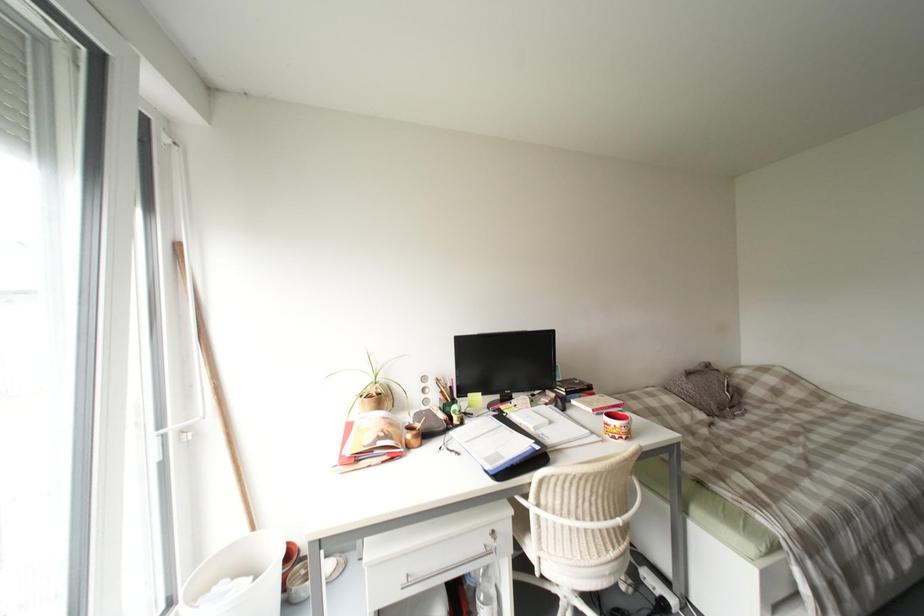
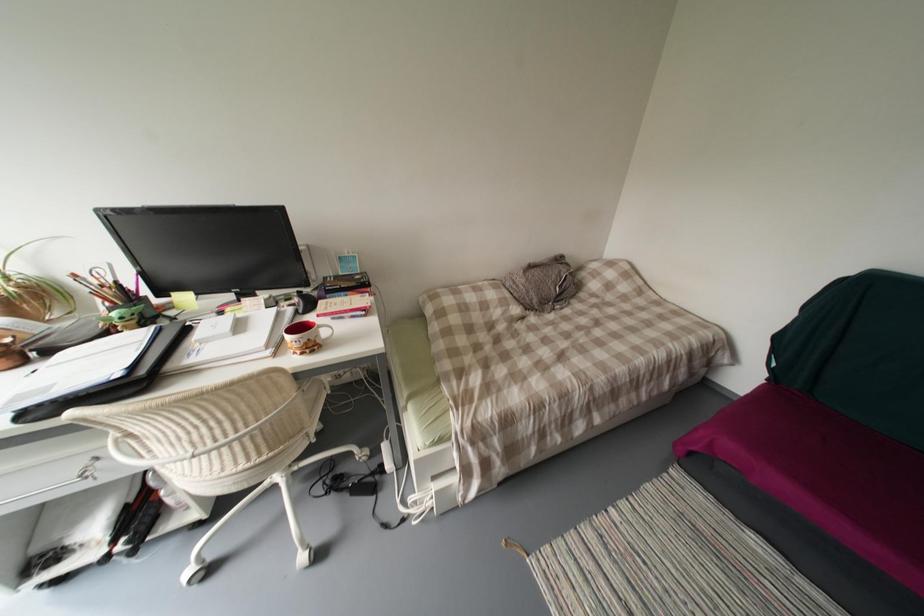
Question: The images are taken continuously from a first-person perspective. In which direction are you moving?

Choices:
 (A) Left
 (B) Right
 (C) Forward
 (D) Backward

Answer: (B)